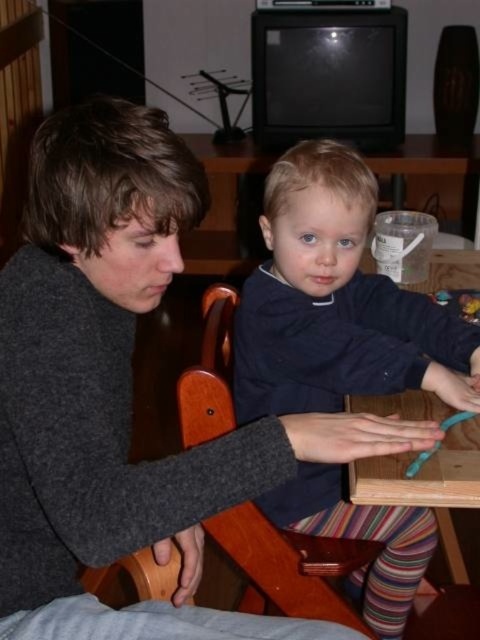
Based on the photo, who is lower down, dark blue sweater at center or wooden chair at center?

Positioned lower is wooden chair at center.

Can you confirm if dark blue sweater at center is bigger than wooden chair at center?

Correct, dark blue sweater at center is larger in size than wooden chair at center.

Is point (262, 326) farther from camera compared to point (284, 548)?

That is False.

The image size is (480, 640). In order to click on dark blue sweater at center in this screenshot , I will do `click(336, 301)`.